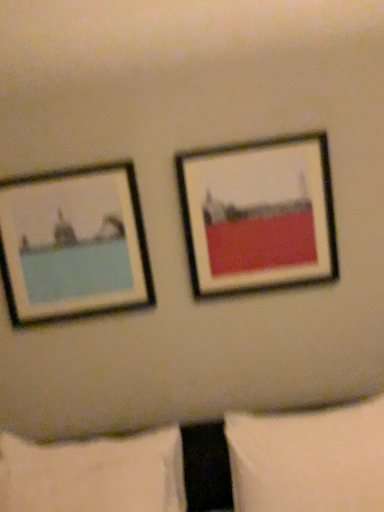
Question: From the image's perspective, is matte black picture frame at left, which is the 1th picture frame from left to right, located beneath white soft pillow at lower left, positioned as the 1th pillow in left-to-right order?

Choices:
 (A) yes
 (B) no

Answer: (B)

Question: Can white soft pillow at lower left, marked as the second pillow in a right-to-left arrangement, be found inside matte black picture frame at left, which appears as the second picture frame when viewed from the right?

Choices:
 (A) yes
 (B) no

Answer: (B)

Question: Is matte black picture frame at left, which is the 1th picture frame from left to right, outside white soft pillow at lower left, marked as the second pillow in a right-to-left arrangement?

Choices:
 (A) yes
 (B) no

Answer: (A)

Question: Is the depth of matte black picture frame at left, which is the 1th picture frame from left to right, less than that of white soft pillow at lower left, positioned as the 1th pillow in left-to-right order?

Choices:
 (A) yes
 (B) no

Answer: (B)

Question: Considering the relative positions of matte black picture frame at left, which is the 1th picture frame from left to right, and white soft pillow at lower left, marked as the second pillow in a right-to-left arrangement, in the image provided, is matte black picture frame at left, which is the 1th picture frame from left to right, to the right of white soft pillow at lower left, marked as the second pillow in a right-to-left arrangement, from the viewer's perspective?

Choices:
 (A) yes
 (B) no

Answer: (B)

Question: Is matte black picture frame at left, which appears as the second picture frame when viewed from the right, at the left side of white soft pillow at lower left, positioned as the 1th pillow in left-to-right order?

Choices:
 (A) yes
 (B) no

Answer: (A)

Question: Is white soft pillow at lower left, positioned as the 1th pillow in left-to-right order, thinner than matte black picture frame at left, which is the 1th picture frame from left to right?

Choices:
 (A) no
 (B) yes

Answer: (A)

Question: From a real-world perspective, is white soft pillow at lower left, marked as the second pillow in a right-to-left arrangement, positioned over matte black picture frame at left, which is the 1th picture frame from left to right, based on gravity?

Choices:
 (A) no
 (B) yes

Answer: (A)

Question: Could you tell me if white soft pillow at lower left, positioned as the 1th pillow in left-to-right order, is turned towards matte black picture frame at left, which is the 1th picture frame from left to right?

Choices:
 (A) no
 (B) yes

Answer: (A)

Question: From a real-world perspective, is white soft pillow at lower left, positioned as the 1th pillow in left-to-right order, under matte black picture frame at left, which is the 1th picture frame from left to right?

Choices:
 (A) no
 (B) yes

Answer: (B)

Question: From the image's perspective, is white soft pillow at lower left, marked as the second pillow in a right-to-left arrangement, under matte black picture frame at left, which appears as the second picture frame when viewed from the right?

Choices:
 (A) yes
 (B) no

Answer: (A)

Question: Considering the relative positions of white soft pillow at lower left, marked as the second pillow in a right-to-left arrangement, and matte black picture frame at left, which appears as the second picture frame when viewed from the right, in the image provided, is white soft pillow at lower left, marked as the second pillow in a right-to-left arrangement, to the left of matte black picture frame at left, which appears as the second picture frame when viewed from the right, from the viewer's perspective?

Choices:
 (A) yes
 (B) no

Answer: (B)

Question: Does matte black picture frame at upper right, the first picture frame when ordered from right to left, come in front of white soft pillow at lower right, the first pillow in the right-to-left sequence?

Choices:
 (A) yes
 (B) no

Answer: (B)